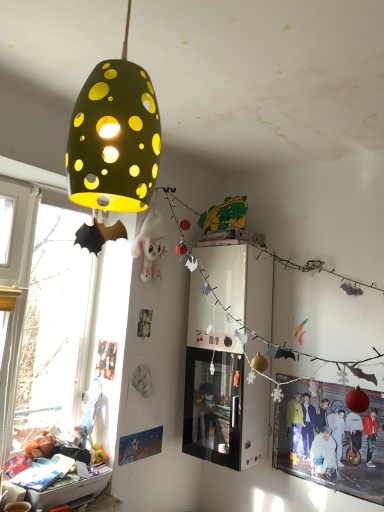
Question: From a real-world perspective, is matte black poster at lower left, which is the 2th poster page from right to left, below red glossy poster at lower right?

Choices:
 (A) yes
 (B) no

Answer: (B)

Question: Does matte black poster at lower left, which ranks as the first poster page in left-to-right order, have a greater width compared to red glossy poster at lower right?

Choices:
 (A) no
 (B) yes

Answer: (A)

Question: Is the surface of matte black poster at lower left, the 1th poster page from the top, in direct contact with red glossy poster at lower right?

Choices:
 (A) yes
 (B) no

Answer: (B)

Question: Is red glossy poster at lower right inside matte black poster at lower left, placed as the second poster page when sorted from bottom to top?

Choices:
 (A) yes
 (B) no

Answer: (B)

Question: From the image's perspective, is matte black poster at lower left, the 1th poster page from the top, under red glossy poster at lower right?

Choices:
 (A) no
 (B) yes

Answer: (A)

Question: Is red glossy poster at lower right bigger or smaller than matte black poster at lower left, the 1th poster page from the top?

Choices:
 (A) big
 (B) small

Answer: (A)

Question: Considering the positions of red glossy poster at lower right and matte black poster at lower left, which ranks as the first poster page in left-to-right order, in the image, is red glossy poster at lower right taller or shorter than matte black poster at lower left, which ranks as the first poster page in left-to-right order,?

Choices:
 (A) short
 (B) tall

Answer: (B)

Question: Is red glossy poster at lower right situated inside matte black poster at lower left, placed as the second poster page when sorted from bottom to top, or outside?

Choices:
 (A) outside
 (B) inside

Answer: (A)

Question: Would you say red glossy poster at lower right is to the left or to the right of matte black poster at lower left, which ranks as the first poster page in left-to-right order, in the picture?

Choices:
 (A) left
 (B) right

Answer: (B)

Question: Is point (87, 179) positioned closer to the camera than point (326, 479)?

Choices:
 (A) farther
 (B) closer

Answer: (B)

Question: Is matte green lampshade at upper left wider or thinner than red glossy poster at lower right?

Choices:
 (A) thin
 (B) wide

Answer: (B)

Question: From the image's perspective, is matte green lampshade at upper left located above or below red glossy poster at lower right?

Choices:
 (A) above
 (B) below

Answer: (A)

Question: Considering the positions of matte green lampshade at upper left and red glossy poster at lower right in the image, is matte green lampshade at upper left bigger or smaller than red glossy poster at lower right?

Choices:
 (A) big
 (B) small

Answer: (A)

Question: Is point pos(125,456) closer or farther from the camera than point pos(104,348)?

Choices:
 (A) farther
 (B) closer

Answer: (B)

Question: From a real-world perspective, is matte paper poster at lower left, positioned as the 1th poster page in bottom-to-top order, positioned above or below matte black poster at lower left, which ranks as the first poster page in left-to-right order?

Choices:
 (A) above
 (B) below

Answer: (B)